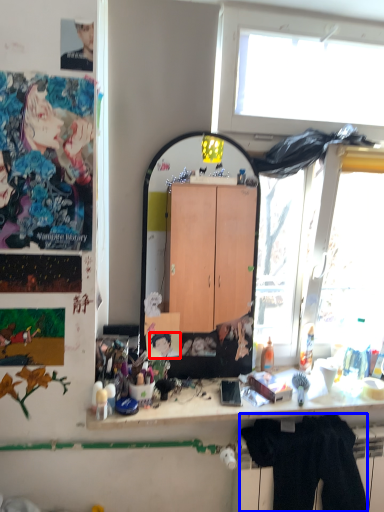
Question: Among these objects, which one is nearest to the camera, person (highlighted by a red box) or clothing (highlighted by a blue box)?

Choices:
 (A) person
 (B) clothing

Answer: (B)